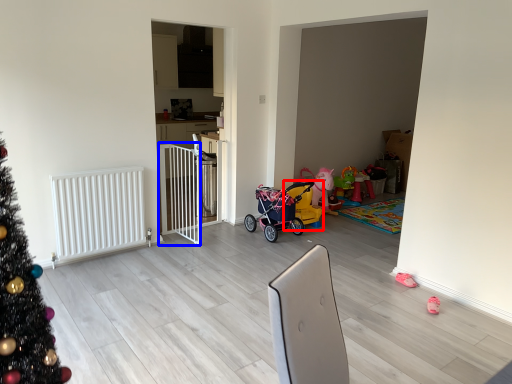
Question: Which object is closer to the camera taking this photo, baby carriage (highlighted by a red box) or balustrade (highlighted by a blue box)?

Choices:
 (A) baby carriage
 (B) balustrade

Answer: (B)